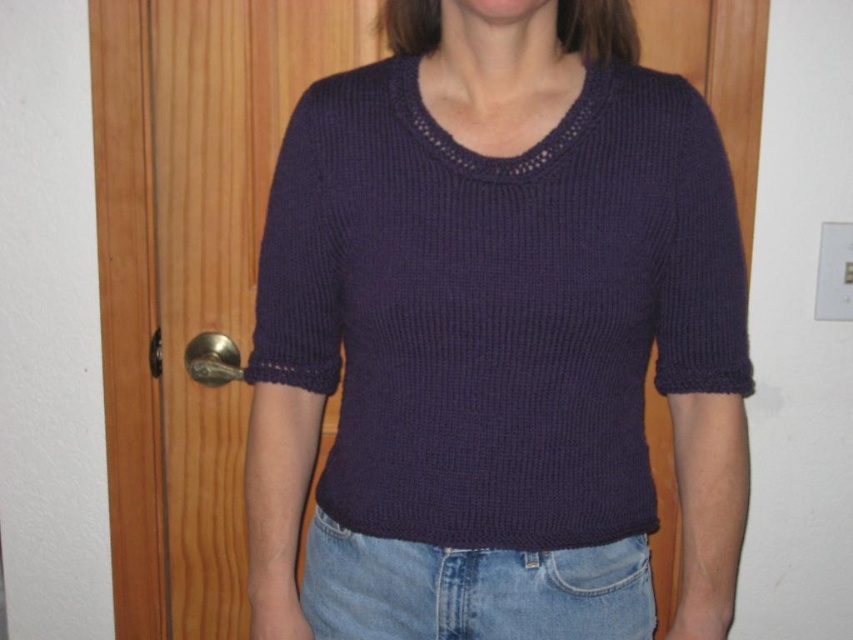
Question: Is dark purple knit sweater at center to the right of denim at lower center from the viewer's perspective?

Choices:
 (A) no
 (B) yes

Answer: (B)

Question: Which object is closer to the camera taking this photo?

Choices:
 (A) dark purple knit sweater at center
 (B) denim at lower center

Answer: (A)

Question: From the image, what is the correct spatial relationship of dark purple knit sweater at center in relation to denim at lower center?

Choices:
 (A) below
 (B) above

Answer: (B)

Question: Is dark purple knit sweater at center positioned in front of denim at lower center?

Choices:
 (A) no
 (B) yes

Answer: (B)

Question: Which point appears closest to the camera in this image?

Choices:
 (A) (563, 420)
 (B) (379, 632)

Answer: (A)

Question: Among these points, which one is farthest from the camera?

Choices:
 (A) (537, 556)
 (B) (726, 273)

Answer: (B)